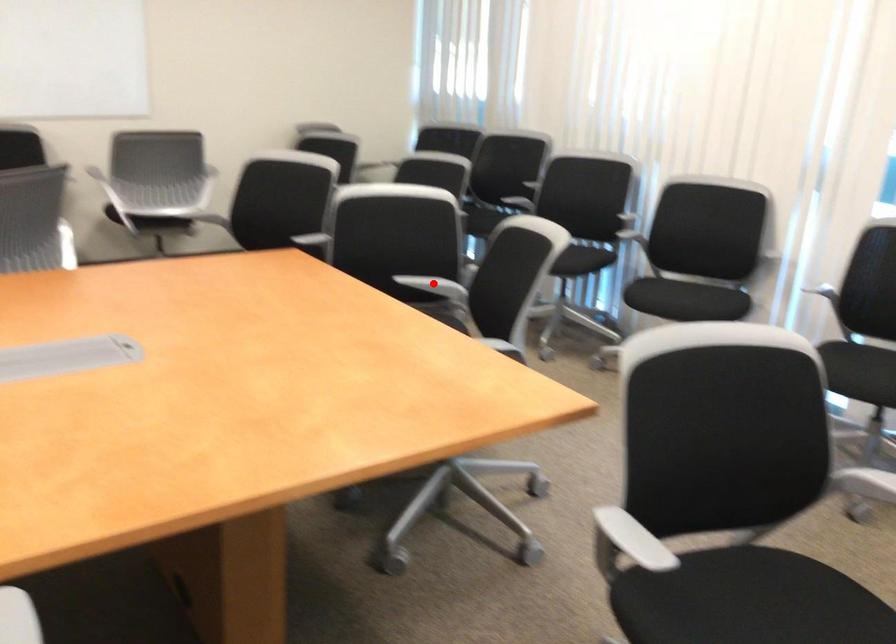
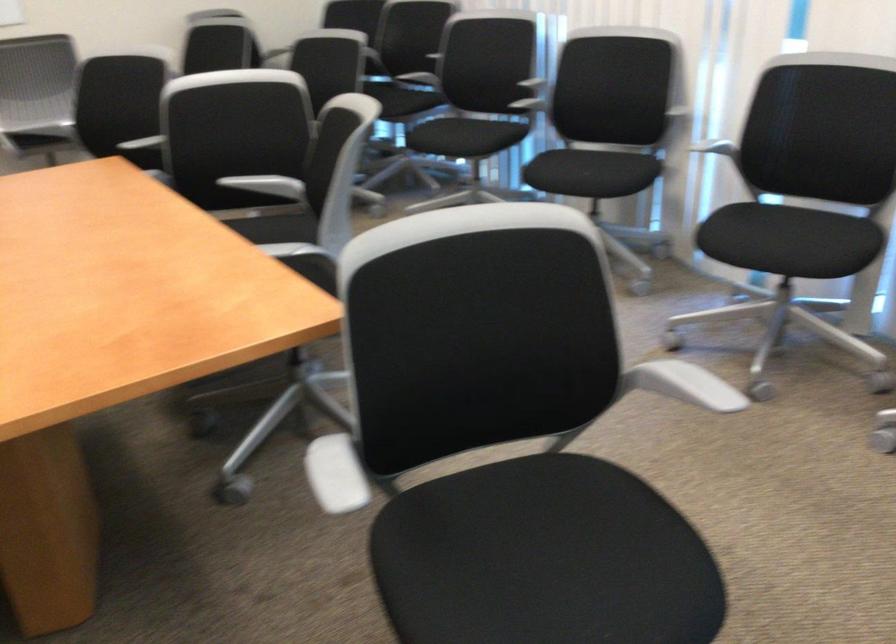
The point at the highlighted location is marked in the first image. Where is the corresponding point in the second image?

(268, 185)